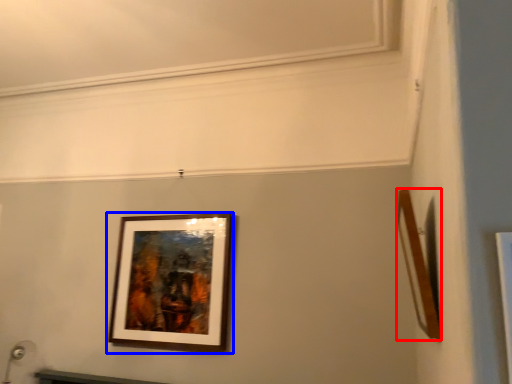
Question: Which object appears farthest to the camera in this image, picture frame (highlighted by a red box) or picture frame (highlighted by a blue box)?

Choices:
 (A) picture frame
 (B) picture frame

Answer: (B)